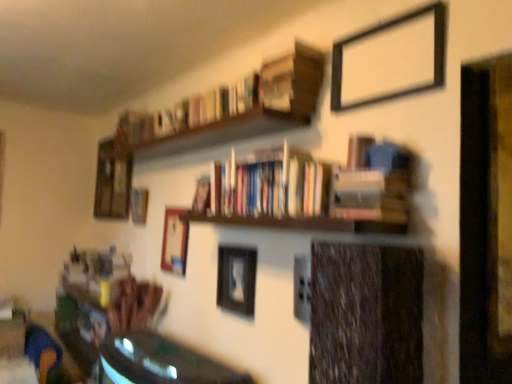
Question: Considering the positions of wooden picture frame at center, placed as the 4th picture frame when sorted from front to back, and hardcover books at upper center, arranged as the 3th book when ordered from the bottom, in the image, is wooden picture frame at center, placed as the 4th picture frame when sorted from front to back, bigger or smaller than hardcover books at upper center, arranged as the 3th book when ordered from the bottom,?

Choices:
 (A) small
 (B) big

Answer: (A)

Question: From a real-world perspective, is wooden picture frame at center, the third picture frame from the back, physically located above or below hardcover books at upper center, arranged as the 3th book when ordered from the bottom?

Choices:
 (A) above
 (B) below

Answer: (B)

Question: Which object is positioned farthest from the black matte picture frame at upper right, which ranks as the 2th picture frame in right-to-left order?

Choices:
 (A) wooden picture frame at upper left, the 5th picture frame positioned from the right
 (B) hardcover books at center, marked as the 2th book in a bottom-to-top arrangement
 (C) shiny green table at lower left
 (D) hardcover books at upper center, which is counted as the first book, starting from the top
 (E) wooden picture frame at center, the third picture frame viewed from the left

Answer: (A)

Question: Estimate the real-world distances between objects in this image. Which object is farther from the wooden picture frame at upper left, which appears as the second picture frame when viewed from the left?

Choices:
 (A) hardcover books at center, marked as the 2th book in a bottom-to-top arrangement
 (B) wooden picture frame at right, acting as the 1th picture frame starting from the front
 (C) wooden picture frame at upper left, marked as the sixth picture frame in a right-to-left arrangement
 (D) black matte picture frame at upper right, which is the second picture frame in front-to-back order
 (E) hardcover books at upper center, which is counted as the first book, starting from the top

Answer: (B)